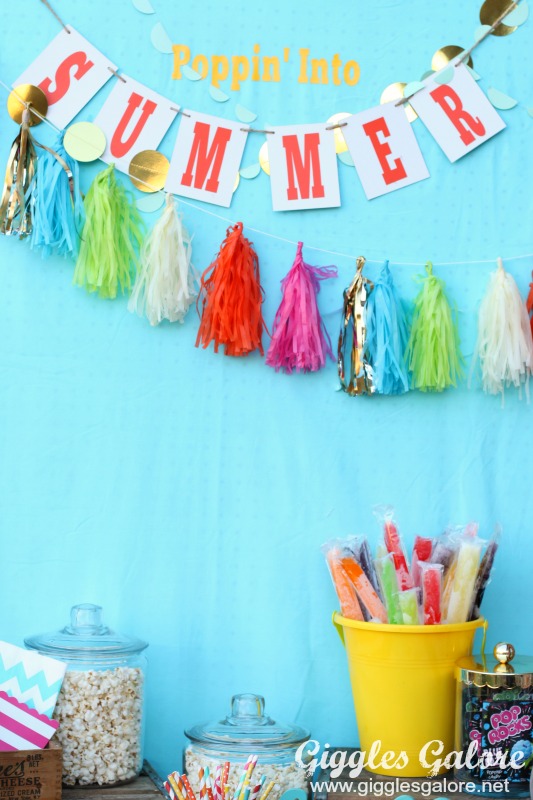
Where is `decorated wood box`? The image size is (533, 800). decorated wood box is located at coordinates (25, 781).